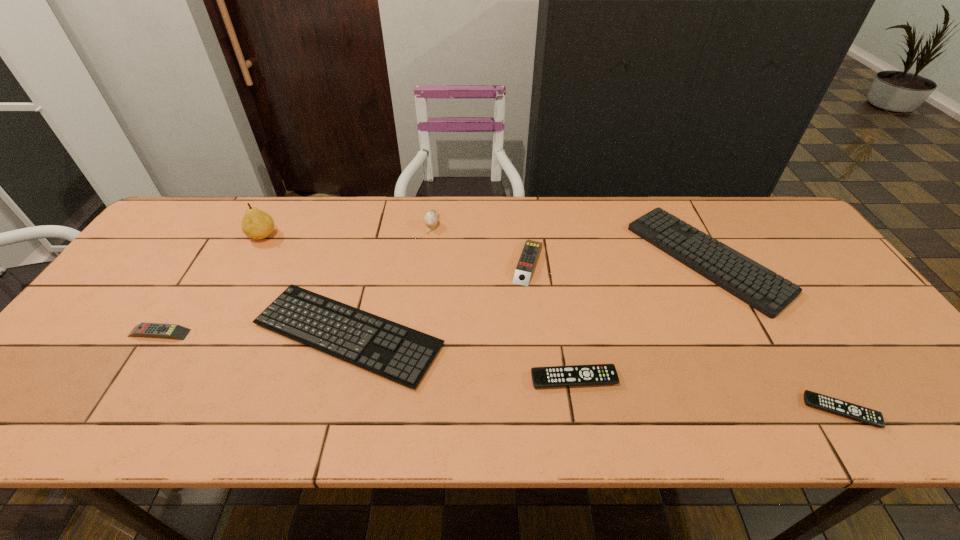
I want to click on vacant area in the image that satisfies the following two spatial constraints: 1. on the front side of the seventh object from right to left; 2. on the left side of the farther black remote control, so click(184, 379).

Where is `free space in the image that satisfies the following two spatial constraints: 1. on the front side of the pear; 2. on the right side of the left computer keyboard`? The height and width of the screenshot is (540, 960). free space in the image that satisfies the following two spatial constraints: 1. on the front side of the pear; 2. on the right side of the left computer keyboard is located at coordinates (209, 334).

You are a GUI agent. You are given a task and a screenshot of the screen. Output one action in this format:
    pyautogui.click(x=<x>, y=<y>)
    Task: Click on the free space that satisfies the following two spatial constraints: 1. on the shell of the second tallest object; 2. on the right side of the smaller black remote control
    This screenshot has height=540, width=960.
    Given the screenshot: What is the action you would take?
    pyautogui.click(x=409, y=410)

Locate an element on the screen. Image resolution: width=960 pixels, height=540 pixels. blank space that satisfies the following two spatial constraints: 1. on the shell of the escargot; 2. on the left side of the bigger black remote control is located at coordinates (413, 379).